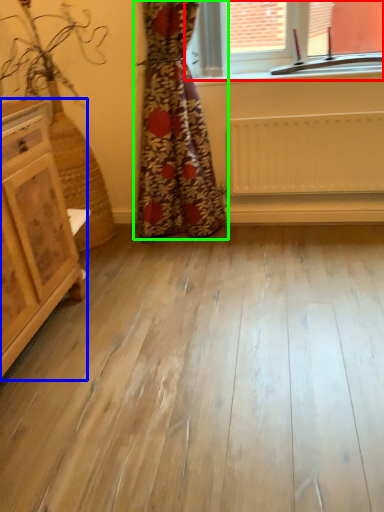
Question: Which is nearer to the window (highlighted by a red box)? chest of drawers (highlighted by a blue box) or curtain (highlighted by a green box).

Choices:
 (A) chest of drawers
 (B) curtain

Answer: (B)